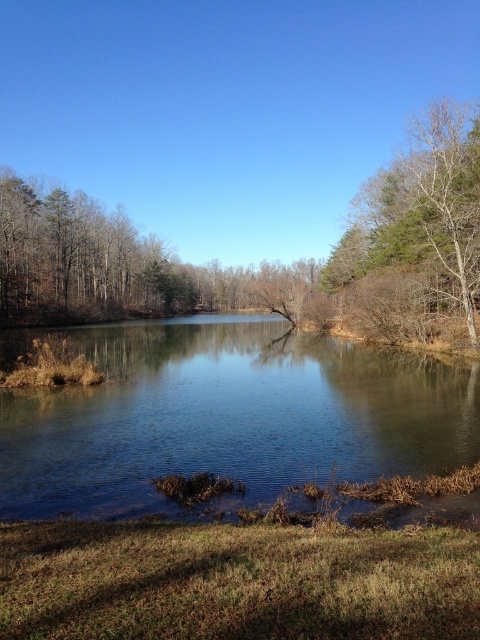
Based on the photo, you are standing at the edge of the grassy area and want to cross to the other side of the clear water at center. The bare branches at right are blocking your path. Can you walk around the branches to reach the water?

The clear water at center might be wider than the bare branches at right, so it is possible that the water is wider than the branches. However, since the branches are blocking the path, you may need to go around them to reach the water.